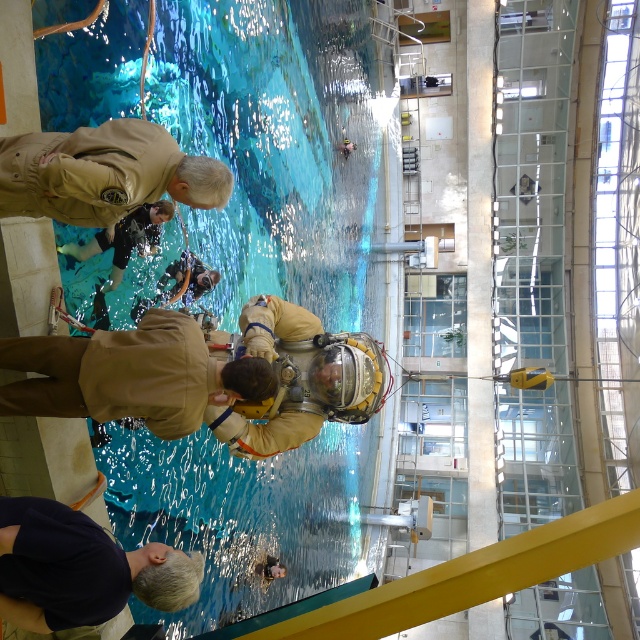
Question: Is blue clear water at center to the left of dark blue shirt at lower left from the viewer's perspective?

Choices:
 (A) yes
 (B) no

Answer: (B)

Question: Which point appears farthest from the camera in this image?

Choices:
 (A) (266, 566)
 (B) (106, 289)

Answer: (A)

Question: In this image, where is dark blue shirt at lower left located relative to tan leather diving suit at upper center?

Choices:
 (A) above
 (B) below

Answer: (B)

Question: Is dark blue shirt at lower left closer to camera compared to light brown leather jacket at lower center?

Choices:
 (A) no
 (B) yes

Answer: (B)

Question: Which object is farther from the camera taking this photo?

Choices:
 (A) tan leather diving suit at upper center
 (B) brown leather jacket at center

Answer: (B)

Question: Which is farther from the blue-green diving suit at center?

Choices:
 (A) light brown leather jacket at lower center
 (B) dark blue shirt at lower left
 (C) blue clear water at center

Answer: (A)